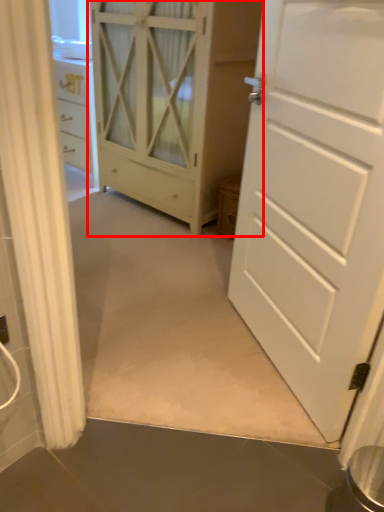
Question: From the image's perspective, what is the correct spatial positioning of cupboard (annotated by the red box) in reference to door?

Choices:
 (A) above
 (B) below

Answer: (A)